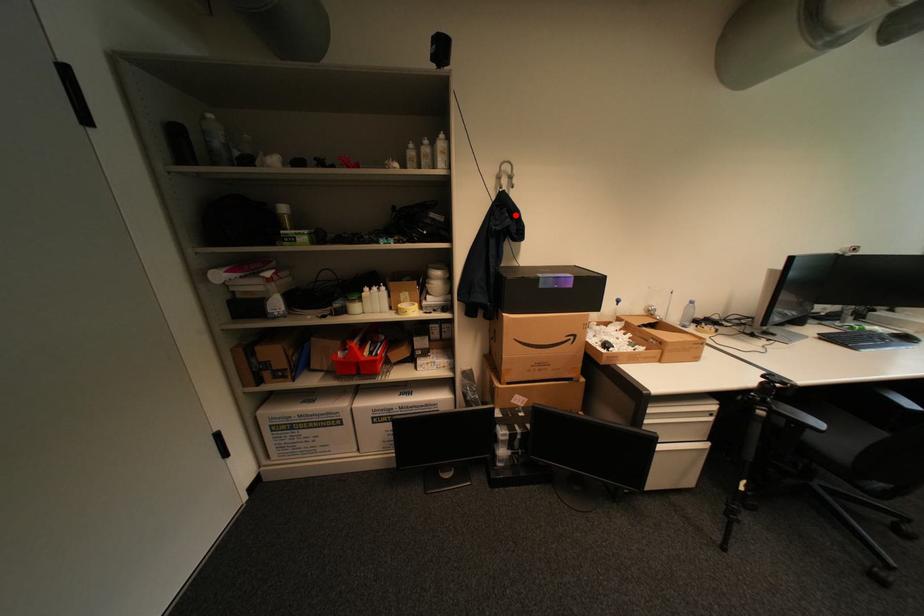
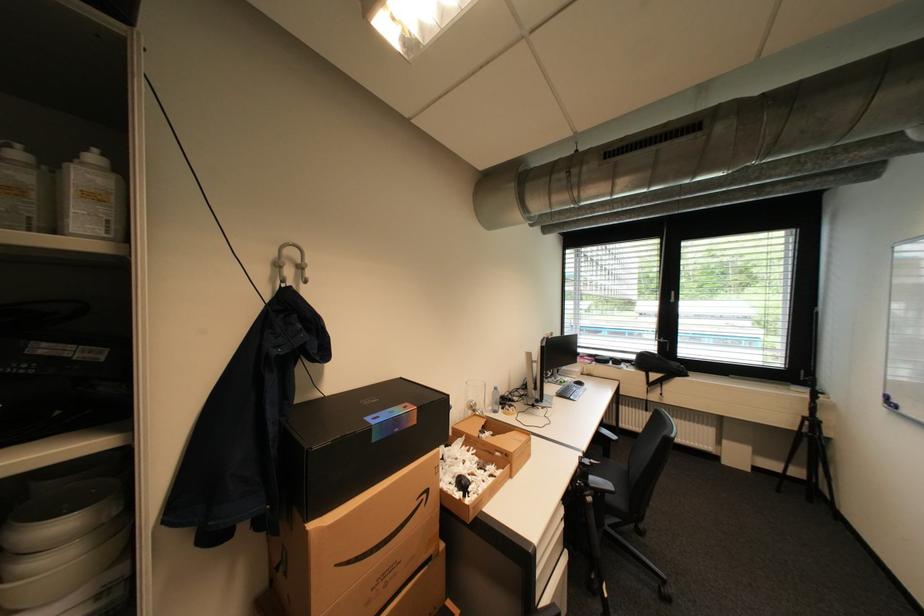
Question: A red point is marked in image1. In image2, is the corresponding 3D point closer to the camera or farther? Reply with the corresponding letter.

Choices:
 (A) The corresponding 3D point is closer.
 (B) The corresponding 3D point is farther.

Answer: (B)